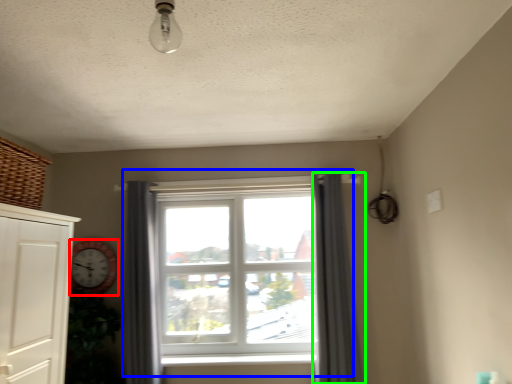
Question: Which object is positioned farthest from clock (highlighted by a red box)? Select from window (highlighted by a blue box) and curtain (highlighted by a green box).

Choices:
 (A) window
 (B) curtain

Answer: (B)